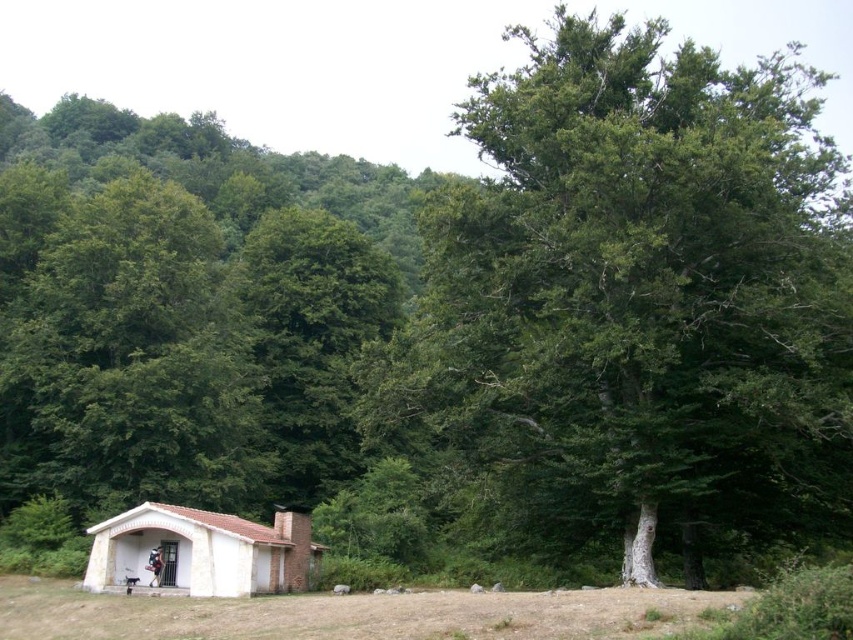
Between green leafy tree at center and white brick hut at lower left, which one is positioned lower?

Positioned lower is white brick hut at lower left.

Can you confirm if green leafy tree at center is positioned to the right of white brick hut at lower left?

Indeed, green leafy tree at center is positioned on the right side of white brick hut at lower left.

Find the location of a particular element. The image size is (853, 640). green leafy tree at center is located at coordinates (637, 300).